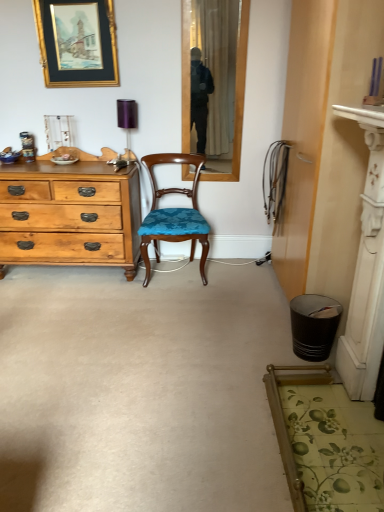
Question: Considering the positions of purple fabric lampshade at upper center and gold-framed picture at upper left in the image, is purple fabric lampshade at upper center taller or shorter than gold-framed picture at upper left?

Choices:
 (A) short
 (B) tall

Answer: (A)

Question: Is purple fabric lampshade at upper center inside the boundaries of gold-framed picture at upper left, or outside?

Choices:
 (A) outside
 (B) inside

Answer: (A)

Question: Based on their relative distances, which object is nearer to the wooden chair with blue upholstery at center?

Choices:
 (A) metallic can at left
 (B) purple fabric lampshade at upper center
 (C) gold-framed picture at upper left
 (D) black textured trash can at lower right

Answer: (B)

Question: Which of these objects is positioned closest to the purple fabric lampshade at upper center?

Choices:
 (A) gold-framed picture at upper left
 (B) metallic can at left
 (C) black textured trash can at lower right
 (D) wooden chair with blue upholstery at center

Answer: (A)